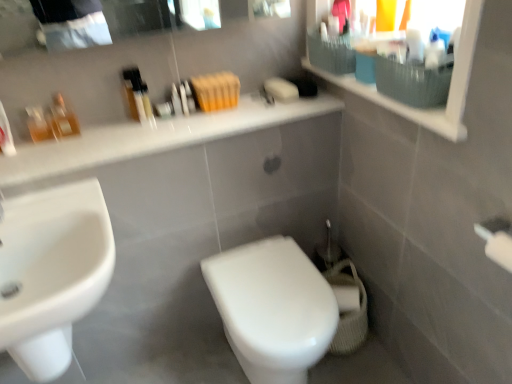
Find the location of a particular element. The width and height of the screenshot is (512, 384). free space in front of translucent glass perfume bottles at upper left, arranged as the 2th toiletry when viewed from the right is located at coordinates (48, 152).